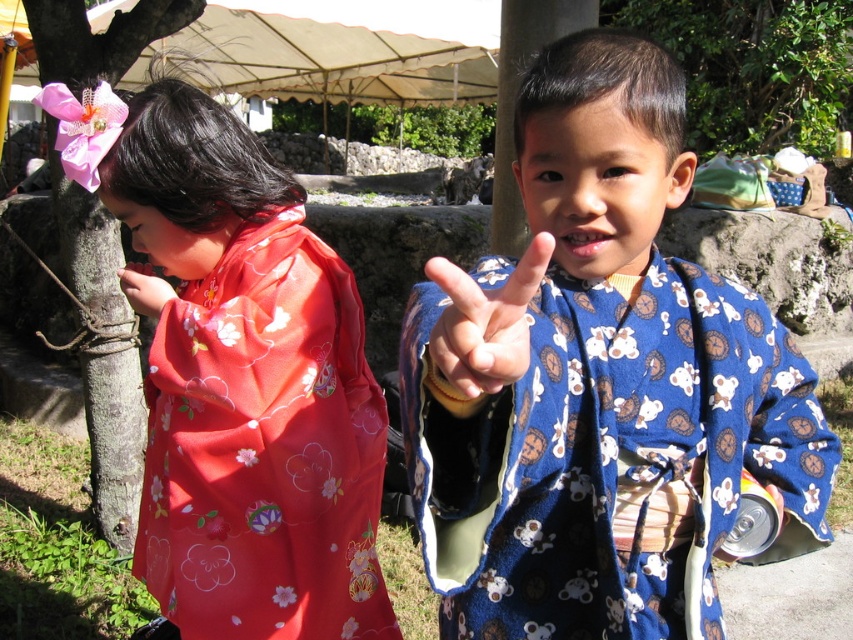
Is point (468, 516) positioned in front of point (148, 468)?

Yes, it is in front of point (148, 468).

Can you confirm if blue printed kimono at center is positioned to the left of matte floral kimono at left?

No, blue printed kimono at center is not to the left of matte floral kimono at left.

Identify the location of blue printed kimono at center. The height and width of the screenshot is (640, 853). (599, 384).

Identify the location of blue printed kimono at center. The image size is (853, 640). (599, 384).

Which is behind, point (187, 525) or point (144, 273)?

The point (144, 273) is more distant.

Is matte floral kimono at left positioned in front of matte pink kimono at left?

That is True.

Does point (263, 204) lie in front of point (166, 289)?

No, (263, 204) is further to viewer.

You are a GUI agent. You are given a task and a screenshot of the screen. Output one action in this format:
    pyautogui.click(x=<x>, y=<y>)
    Task: Click on the matte floral kimono at left
    
    Given the screenshot: What is the action you would take?
    pyautogui.click(x=239, y=376)

Between blue printed kimono at center and matte pink kimono at left, which one is positioned higher?

matte pink kimono at left is higher up.

Which of these two, blue printed kimono at center or matte pink kimono at left, stands taller?

blue printed kimono at center

Between point (647, 376) and point (144, 308), which one is positioned in front?

Point (647, 376) is in front.

Find the location of a particular element. blue printed kimono at center is located at coordinates (599, 384).